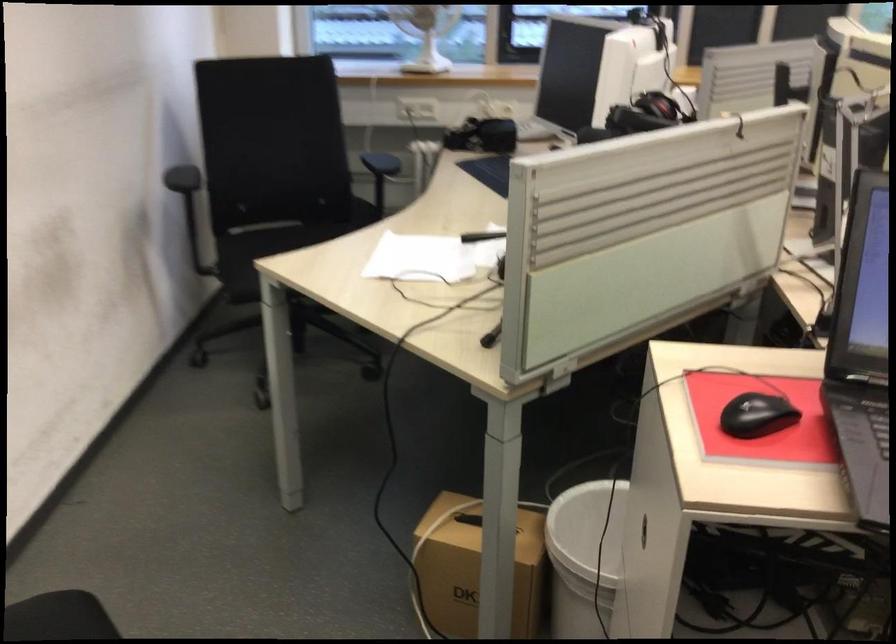
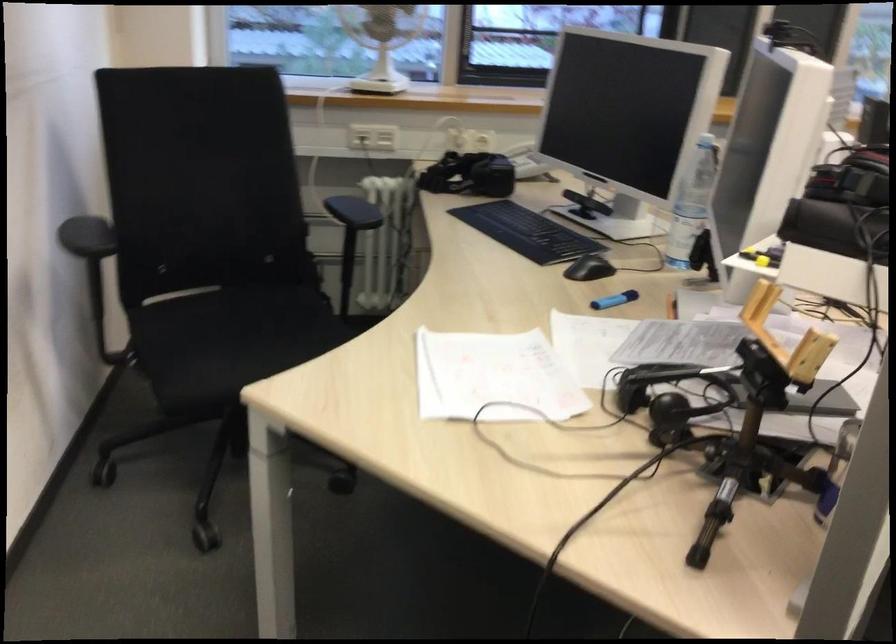
In a continuous first-person perspective shot, in which direction is the camera moving?

The movement direction of the cameraman is left, forward.